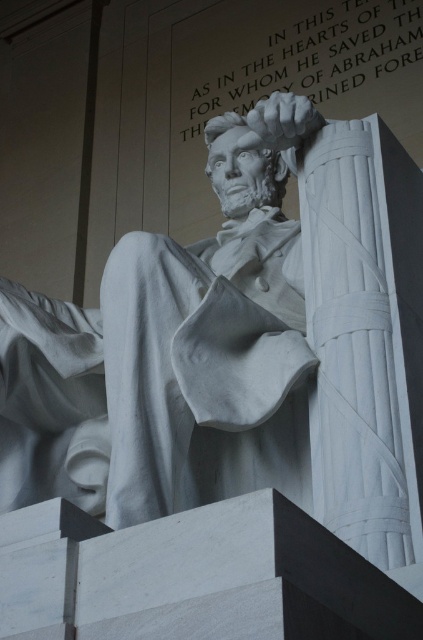
Can you confirm if white marble robe at center is wider than white marble text at upper center?

In fact, white marble robe at center might be narrower than white marble text at upper center.

What do you see at coordinates (205, 369) in the screenshot? I see `white marble robe at center` at bounding box center [205, 369].

The width and height of the screenshot is (423, 640). I want to click on white marble robe at center, so click(205, 369).

Can you confirm if white marble robe at center is positioned above white marble column at right?

Yes.

Does point (230, 289) come closer to viewer compared to point (400, 252)?

Yes, point (230, 289) is closer to viewer.

You are a GUI agent. You are given a task and a screenshot of the screen. Output one action in this format:
    pyautogui.click(x=<x>, y=<y>)
    Task: Click on the white marble robe at center
    
    Given the screenshot: What is the action you would take?
    pyautogui.click(x=205, y=369)

Can you confirm if white marble column at right is bigger than white marble text at upper center?

Actually, white marble column at right might be smaller than white marble text at upper center.

Who is higher up, white marble column at right or white marble text at upper center?

white marble text at upper center is above.

Which is behind, point (409, 420) or point (216, 22)?

The point (216, 22) is more distant.

Locate an element on the screen. The width and height of the screenshot is (423, 640). white marble column at right is located at coordinates (365, 336).